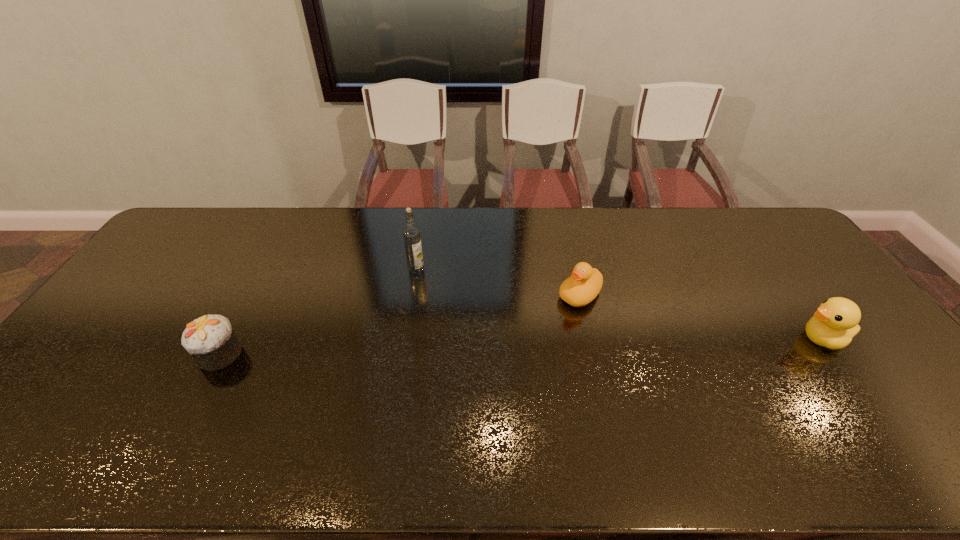
Locate an element on the screen. This screenshot has width=960, height=540. vacant position located 0.160m on the face of the rightmost object is located at coordinates (739, 339).

Locate an element on the screen. vacant area situated on the label of the farthest object is located at coordinates (442, 335).

Where is `vacant region located 0.100m on the label of the farthest object`? vacant region located 0.100m on the label of the farthest object is located at coordinates (426, 297).

What are the coordinates of `vacant space located 0.400m on the label of the farthest object` in the screenshot? It's located at (458, 375).

At what (x,y) coordinates should I click in order to perform the action: click on free space located on the face of the third object from left to right. Please return your answer as a coordinate pair (x, y). The width and height of the screenshot is (960, 540). Looking at the image, I should click on (472, 382).

At what (x,y) coordinates should I click in order to perform the action: click on free location located on the face of the third object from left to right. Please return your answer as a coordinate pair (x, y). Looking at the image, I should click on (527, 337).

Locate an element on the screen. This screenshot has width=960, height=540. blank area located on the face of the third object from left to right is located at coordinates (505, 355).

Locate an element on the screen. This screenshot has width=960, height=540. object that is at the right edge is located at coordinates (835, 323).

The height and width of the screenshot is (540, 960). Find the location of `vacant space at the far edge of the desktop`. vacant space at the far edge of the desktop is located at coordinates (456, 224).

Find the location of a particular element. This screenshot has height=540, width=960. free space at the near edge of the desktop is located at coordinates (706, 414).